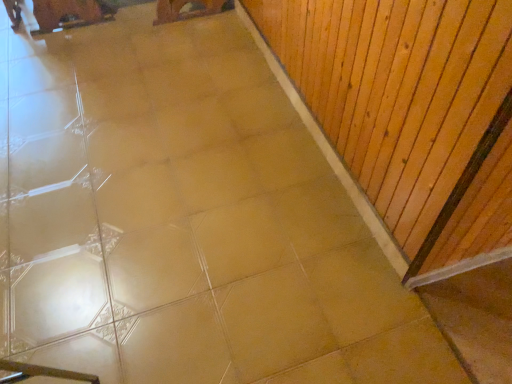
Identify the location of vacant area situated below natural wood plywood at upper right (from a real-world perspective). (307, 135).